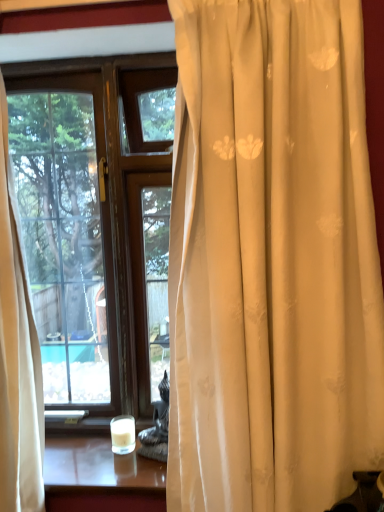
This screenshot has width=384, height=512. Identify the location of vacant region in front of black textured statue at lower center. (147, 476).